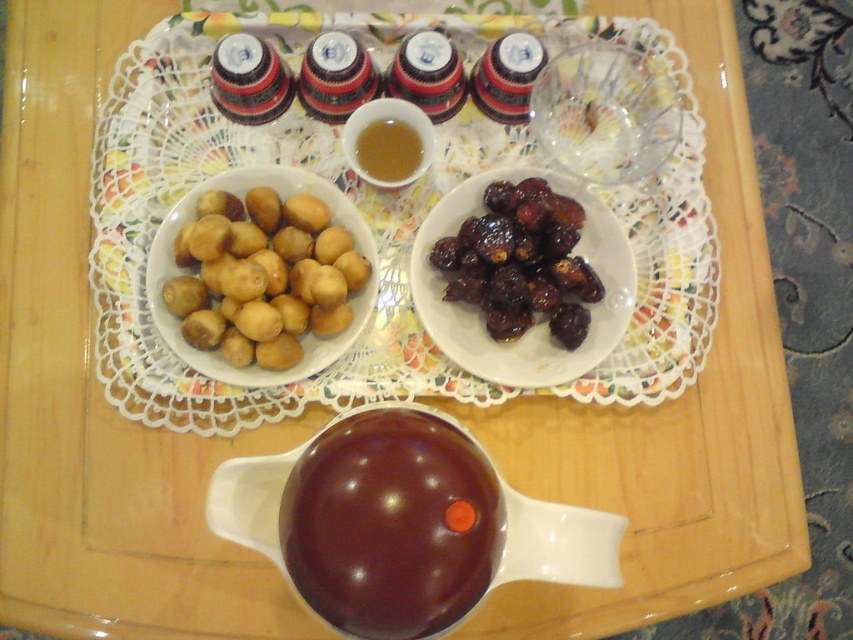
You are a guest at an Iftar gathering and want to pour honey from the small white dish between the two bowls onto your dates. The dates you chose are the shiny dark brown dates at center right. To do this, must you move the white ceramic platter at center out of the way?

The white ceramic platter at center is above the shiny dark brown dates at center right, so you would need to move it to access the dates or the honey dish between the bowls.

You are a guest at an Iftar dinner and want to reach for the shiny dark brown dates at center right. However, there is a golden matte potatoes at left in your path. Which item should you move first to access the dates?

You should move the golden matte potatoes at left first because it is positioned on the left side of the shiny dark brown dates at center right, blocking the path to them.

You are setting up a table for Iftar and want to place a decorative centerpiece between the white ceramic platter at center and the golden matte potatoes at left. Based on their sizes, which item should you place closer to the edge of the table to ensure the centerpiece fits?

The golden matte potatoes at left should be placed closer to the edge of the table because the white ceramic platter at center might be wider, leaving more space between them for the centerpiece.